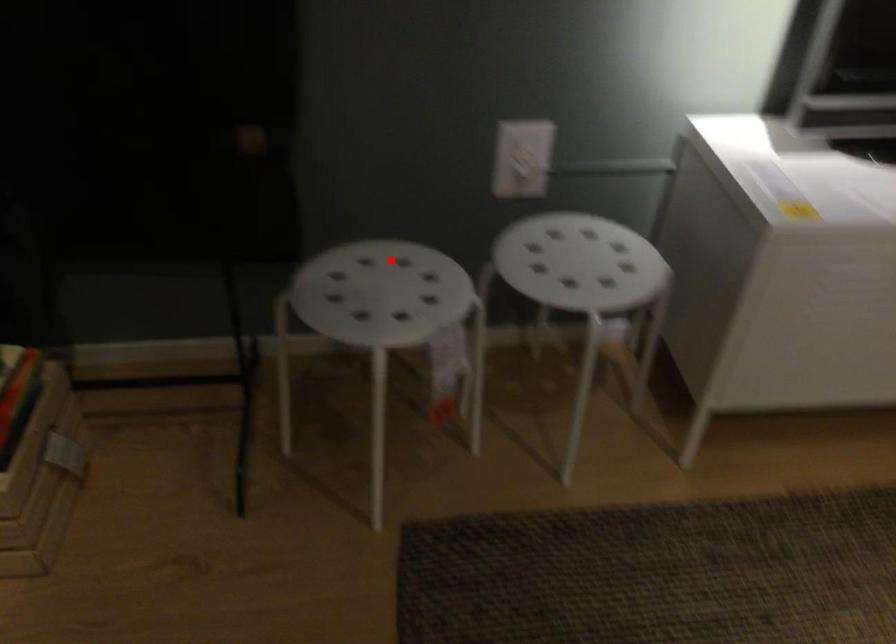
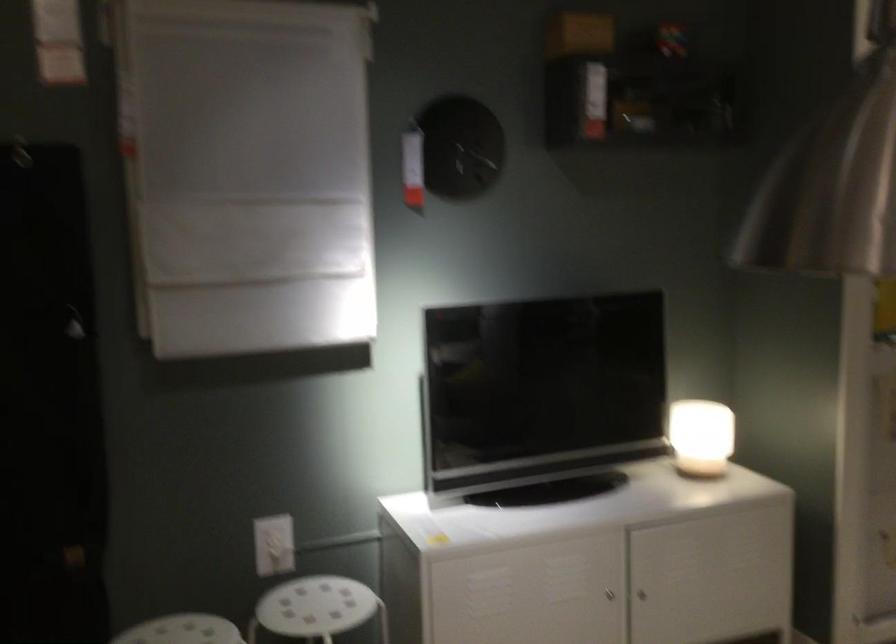
Question: A red point is marked in image1. In image2, is the corresponding 3D point closer to the camera or farther? Reply with the corresponding letter.

Choices:
 (A) The corresponding 3D point is closer.
 (B) The corresponding 3D point is farther.

Answer: (B)